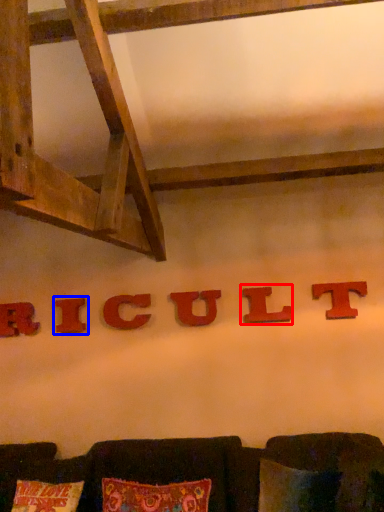
Question: Which object appears closest to the camera in this image, alphabet (highlighted by a red box) or alphabet (highlighted by a blue box)?

Choices:
 (A) alphabet
 (B) alphabet

Answer: (A)